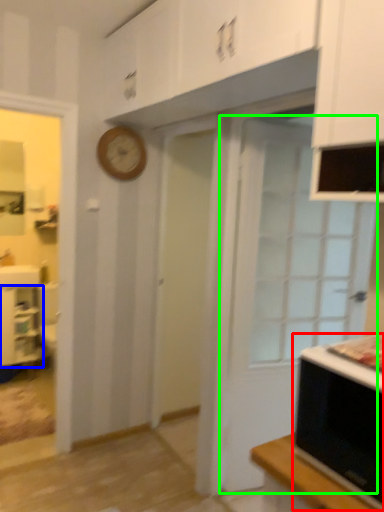
Question: Based on their relative distances, which object is farther from microwave oven (highlighted by a red box)? Choose from cabinetry (highlighted by a blue box) and door (highlighted by a green box).

Choices:
 (A) cabinetry
 (B) door

Answer: (A)